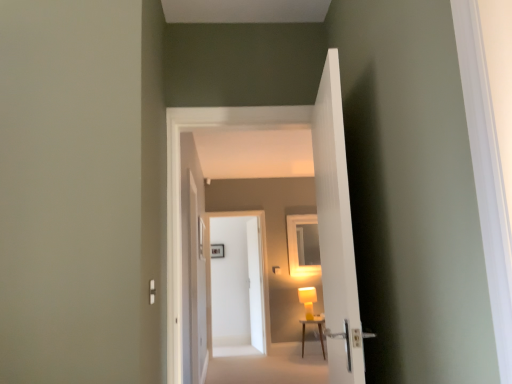
Question: Is matte yellow lamp at center touching white glossy door at center, the first door from the back?

Choices:
 (A) yes
 (B) no

Answer: (B)

Question: Does matte yellow lamp at center have a greater height compared to white glossy door at center, arranged as the fourth door when viewed from the front?

Choices:
 (A) yes
 (B) no

Answer: (B)

Question: From the image's perspective, does matte yellow lamp at center appear higher than white glossy door at center, the first door from the back?

Choices:
 (A) yes
 (B) no

Answer: (A)

Question: From a real-world perspective, is matte yellow lamp at center positioned over white glossy door at center, arranged as the fourth door when viewed from the front, based on gravity?

Choices:
 (A) no
 (B) yes

Answer: (B)

Question: Is matte yellow lamp at center surrounding white glossy door at center, the first door from the back?

Choices:
 (A) no
 (B) yes

Answer: (A)

Question: Considering the positions of wooden table at center and white glossy door at center, which is the second door in back-to-front order, in the image, is wooden table at center wider or thinner than white glossy door at center, which is the second door in back-to-front order,?

Choices:
 (A) thin
 (B) wide

Answer: (B)

Question: From the image's perspective, is wooden table at center positioned above or below white glossy door at center, marked as the third door in a front-to-back arrangement?

Choices:
 (A) above
 (B) below

Answer: (B)

Question: From a real-world perspective, is wooden table at center physically located above or below white glossy door at center, marked as the third door in a front-to-back arrangement?

Choices:
 (A) below
 (B) above

Answer: (A)

Question: Which is correct: wooden table at center is inside white glossy door at center, marked as the third door in a front-to-back arrangement, or outside of it?

Choices:
 (A) inside
 (B) outside

Answer: (B)

Question: Looking at their shapes, would you say white carpet at lower center is wider or thinner than white glossy door at center, the first door from the back?

Choices:
 (A) wide
 (B) thin

Answer: (A)

Question: In the image, is white carpet at lower center positioned in front of or behind white glossy door at center, arranged as the fourth door when viewed from the front?

Choices:
 (A) behind
 (B) front

Answer: (B)

Question: Is point (292, 374) closer or farther from the camera than point (250, 324)?

Choices:
 (A) closer
 (B) farther

Answer: (A)

Question: In the image, is white carpet at lower center on the left side or the right side of white glossy door at center, the first door from the back?

Choices:
 (A) left
 (B) right

Answer: (B)

Question: From their relative heights in the image, would you say matte yellow table lamp at center is taller or shorter than white ribbed door at center, which is the 1th door in front-to-back order?

Choices:
 (A) short
 (B) tall

Answer: (A)

Question: From a real-world perspective, is matte yellow table lamp at center positioned above or below white ribbed door at center, which is the 1th door in front-to-back order?

Choices:
 (A) above
 (B) below

Answer: (B)